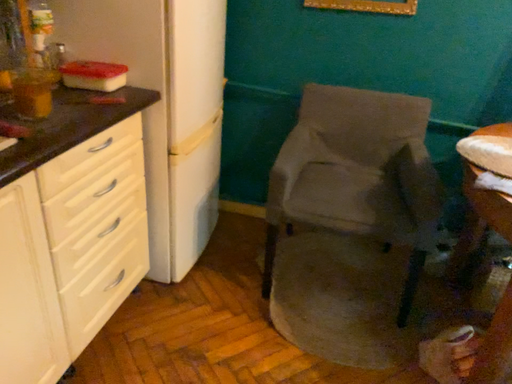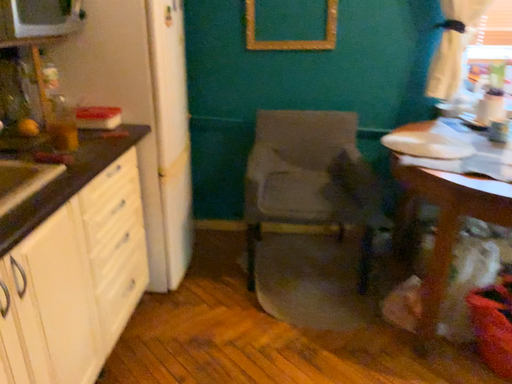
Question: Which way did the camera rotate in the video?

Choices:
 (A) rotated left
 (B) rotated right

Answer: (B)